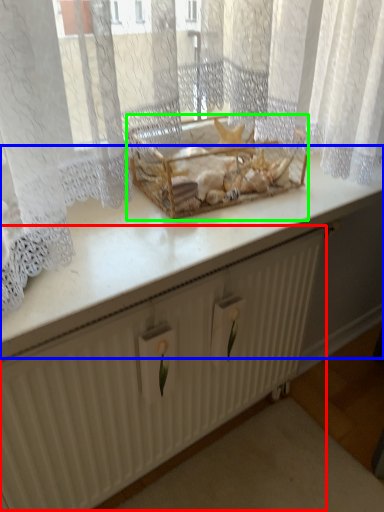
Question: Estimate the real-world distances between objects in this image. Which object is farther from radiator (highlighted by a red box), counter top (highlighted by a blue box) or crate (highlighted by a green box)?

Choices:
 (A) counter top
 (B) crate

Answer: (B)